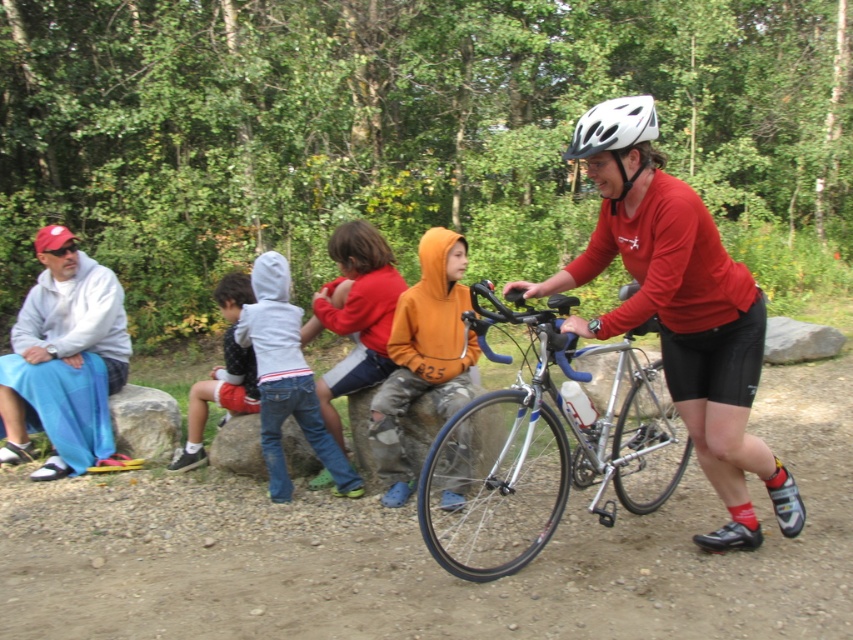
In the scene shown: You are packing for a hike and see both the orange fleece jacket at center and the white cotton hoodie at center in your bag. Which one takes up more vertical space in your bag?

The orange fleece jacket at center is taller than the white cotton hoodie at center, so it takes up more vertical space in the bag.

You are a hiker who has just arrived at the trailhead and sees the light gray fleece jacket at left and the orange fleece jacket at center. Which jacket is closer to the left edge of the image?

The light gray fleece jacket at left is closer to the left edge of the image because it is positioned on the left side of the orange fleece jacket at center.